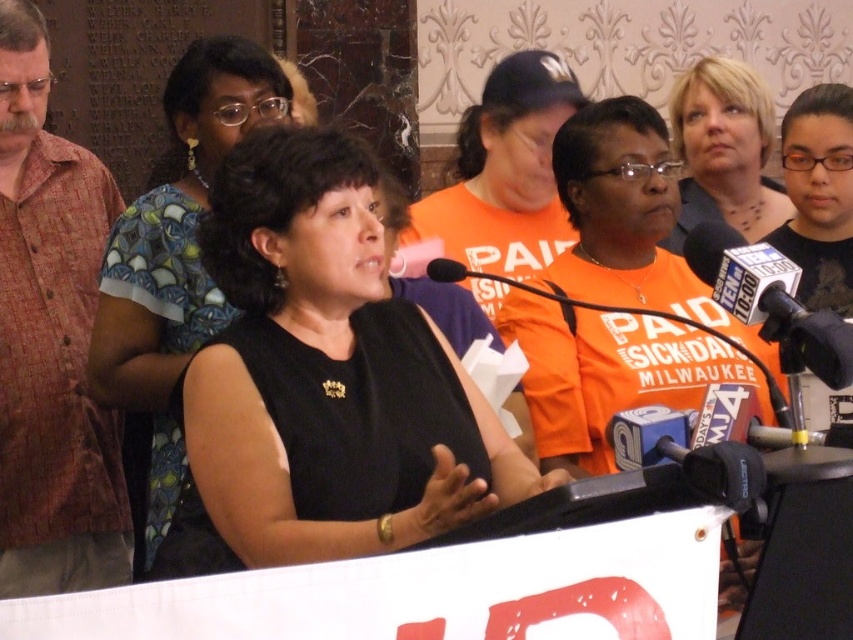
Which of these two, reddish-brown button-up shirt at left or orange cotton shirt at center, stands shorter?

orange cotton shirt at center

Is reddish-brown button-up shirt at left shorter than orange cotton shirt at center?

Incorrect, reddish-brown button-up shirt at left's height does not fall short of orange cotton shirt at center's.

This screenshot has width=853, height=640. I want to click on reddish-brown button-up shirt at left, so click(x=51, y=340).

Measure the distance between point (653,221) and camera.

The distance of point (653,221) from camera is 62.85 feet.

Which is above, orange cotton shirt at center or black fabric shirt at center?

Positioned higher is orange cotton shirt at center.

At what (x,y) coordinates should I click in order to perform the action: click on orange cotton shirt at center. Please return your answer as a coordinate pair (x, y). Looking at the image, I should click on (630, 220).

Where is `orange cotton shirt at center`? This screenshot has width=853, height=640. orange cotton shirt at center is located at coordinates (630, 220).

Who is lower down, orange cotton shirt at center or metallic silver microphone at center right?

metallic silver microphone at center right

Can you confirm if orange cotton shirt at center is bigger than metallic silver microphone at center right?

No, orange cotton shirt at center is not bigger than metallic silver microphone at center right.

Image resolution: width=853 pixels, height=640 pixels. Describe the element at coordinates (630, 220) in the screenshot. I see `orange cotton shirt at center` at that location.

Where is `orange cotton shirt at center`? This screenshot has height=640, width=853. orange cotton shirt at center is located at coordinates (630, 220).